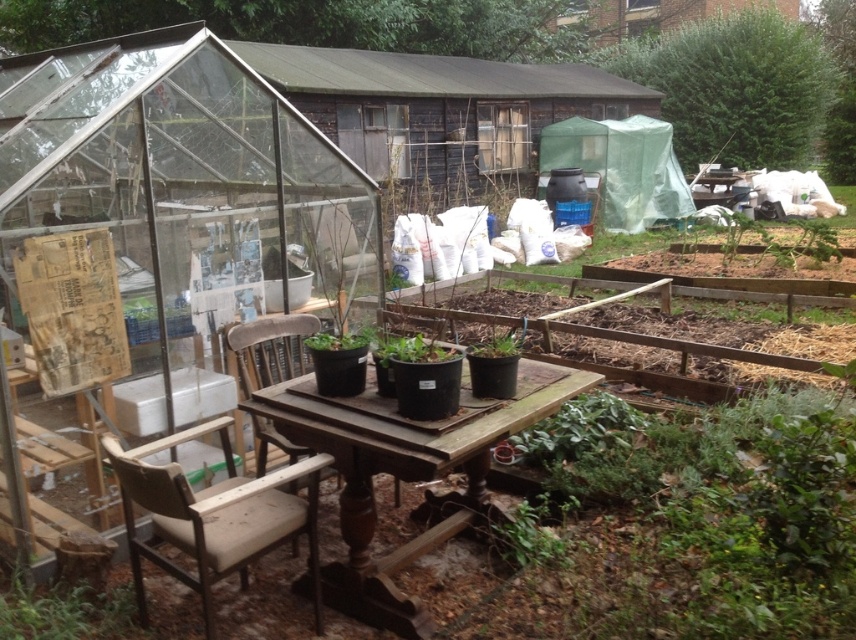
Question: Estimate the real-world distances between objects in this image. Which object is farther from the wooden table at center?

Choices:
 (A) beige fabric chair at lower left
 (B) brown wooden chair at center
 (C) green matte pot at center

Answer: (C)

Question: Is wooden table at center wider than green matte plant at lower left?

Choices:
 (A) yes
 (B) no

Answer: (A)

Question: Can you confirm if wooden table at center is positioned to the left of green matte plant at lower left?

Choices:
 (A) no
 (B) yes

Answer: (A)

Question: Which object is the closest to the green matte plant at lower left?

Choices:
 (A) brown wooden chair at center
 (B) beige fabric chair at lower left

Answer: (B)

Question: Can you confirm if beige fabric chair at lower left is smaller than brown wooden chair at center?

Choices:
 (A) yes
 (B) no

Answer: (B)

Question: Which of the following is the closest to the observer?

Choices:
 (A) green matte pot at center
 (B) brown wooden chair at center
 (C) beige fabric chair at lower left

Answer: (C)